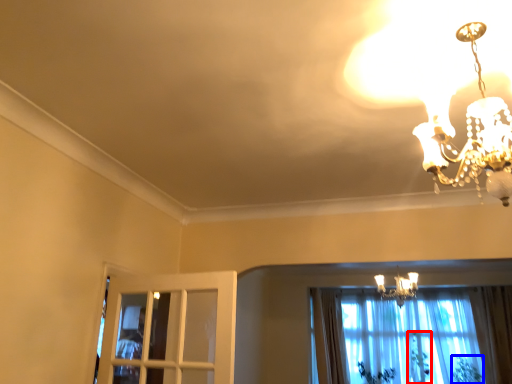
Question: Which object appears farthest to the camera in this image, plant (highlighted by a red box) or plant (highlighted by a blue box)?

Choices:
 (A) plant
 (B) plant

Answer: (A)